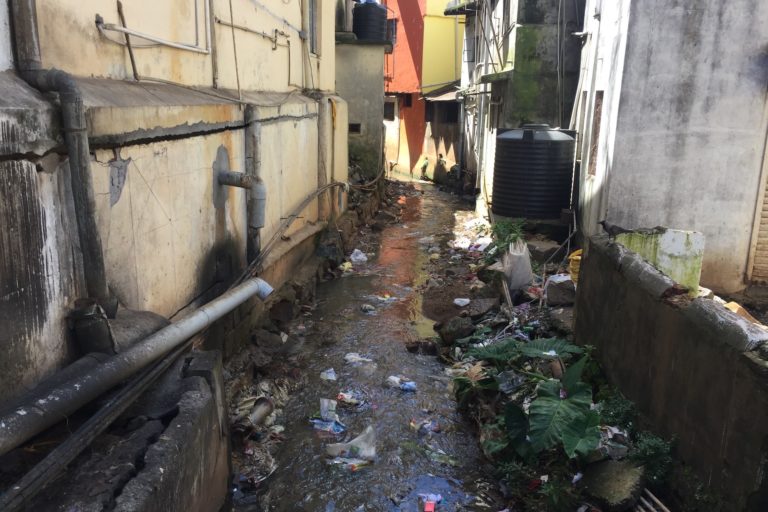
This screenshot has width=768, height=512. What are the coordinates of `trash` in the screenshot? It's located at (394, 385).